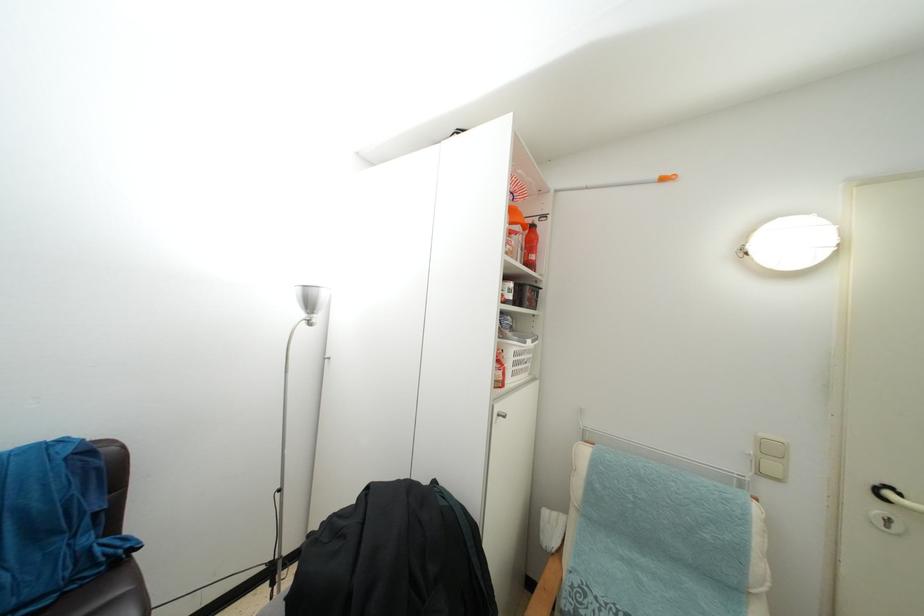
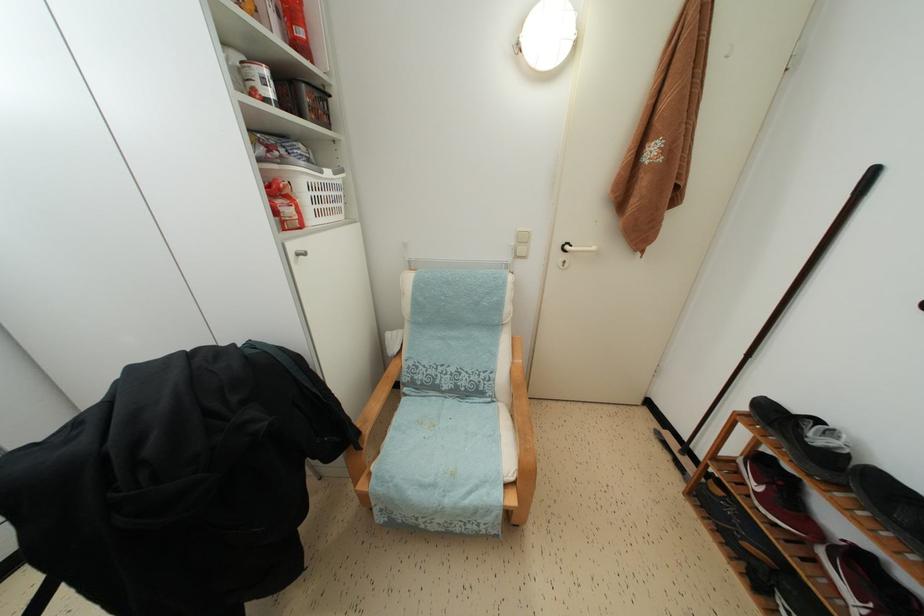
The point at (893, 500) is marked in the first image. Where is the corresponding point in the second image?

(572, 253)